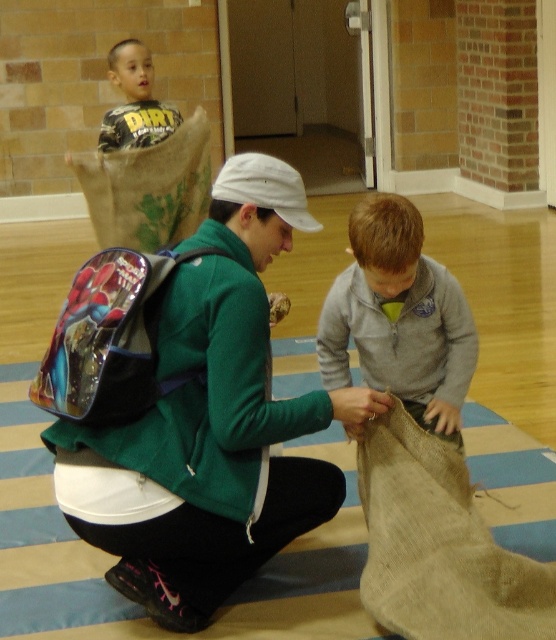
Measure the distance from shiny blue backpack at center to matte yellow shirt at upper left.

shiny blue backpack at center and matte yellow shirt at upper left are 3.33 meters apart.

Can you confirm if shiny blue backpack at center is wider than matte yellow shirt at upper left?

Indeed, shiny blue backpack at center has a greater width compared to matte yellow shirt at upper left.

Is point (118, 307) positioned after point (181, 120)?

No, (118, 307) is in front of (181, 120).

What are the coordinates of `shiny blue backpack at center` in the screenshot? It's located at (111, 339).

Which is more to the right, green fabric backpack at center or shiny blue backpack at center?

From the viewer's perspective, green fabric backpack at center appears more on the right side.

Can you confirm if green fabric backpack at center is shorter than shiny blue backpack at center?

In fact, green fabric backpack at center may be taller than shiny blue backpack at center.

Which is in front, point (176, 428) or point (136, 328)?

Positioned in front is point (136, 328).

This screenshot has height=640, width=556. What are the coordinates of `green fabric backpack at center` in the screenshot? It's located at pos(210,422).

Who is positioned more to the right, gray fleece sweater at center or matte yellow shirt at upper left?

gray fleece sweater at center

Who is higher up, gray fleece sweater at center or matte yellow shirt at upper left?

matte yellow shirt at upper left

Is point (441, 348) more distant than point (135, 132)?

No, (441, 348) is closer to viewer.

Where is `gray fleece sweater at center`? gray fleece sweater at center is located at coordinates (399, 317).